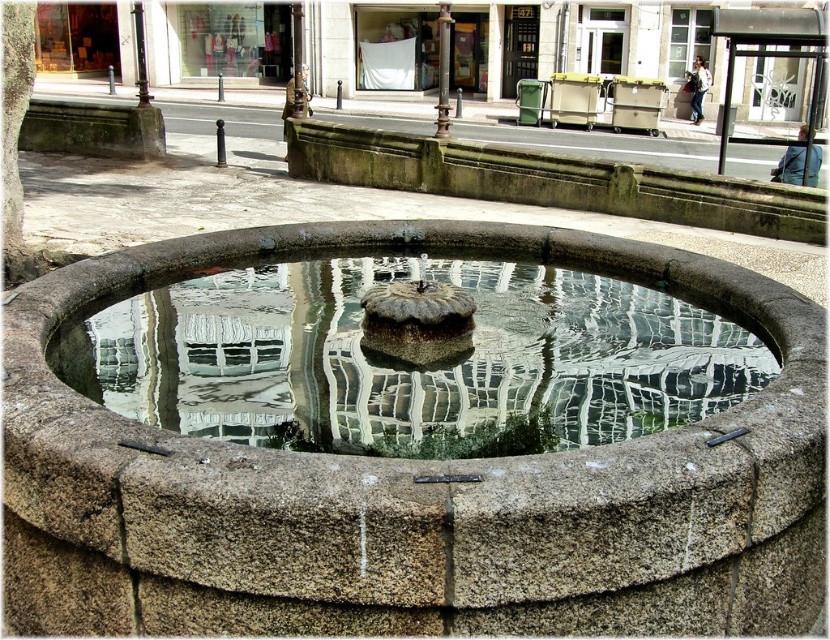
Where is `granite fountain at center`? granite fountain at center is located at coordinates (413, 490).

Which is in front, point (159, 611) or point (294, 323)?

Point (159, 611) is in front.

Between point (44, 433) and point (645, 422), which one is positioned in front?

Positioned in front is point (44, 433).

Identify the location of granite fountain at center. The width and height of the screenshot is (830, 640). (413, 490).